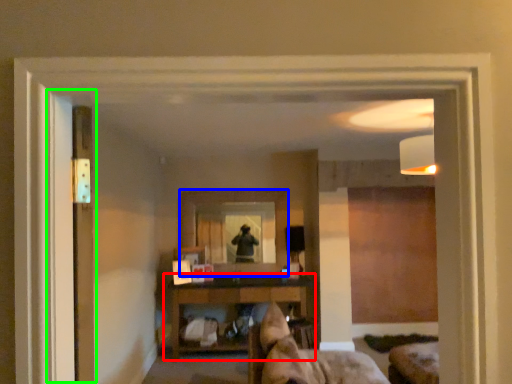
Question: Which is farther away from shelf (highlighted by a red box)? mirror (highlighted by a blue box) or screen door (highlighted by a green box)?

Choices:
 (A) mirror
 (B) screen door

Answer: (B)